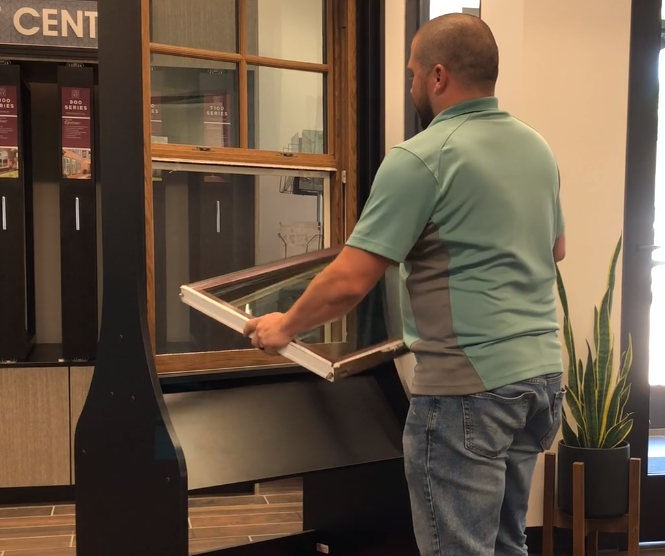
This screenshot has height=556, width=665. What are the coordinates of `pot` in the screenshot? It's located at (602, 485).